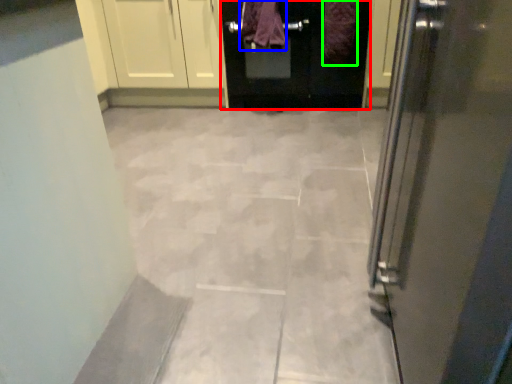
Question: Considering the real-world distances, which object is farthest from door (highlighted by a red box)? blanket (highlighted by a blue box) or blanket (highlighted by a green box)?

Choices:
 (A) blanket
 (B) blanket

Answer: (B)